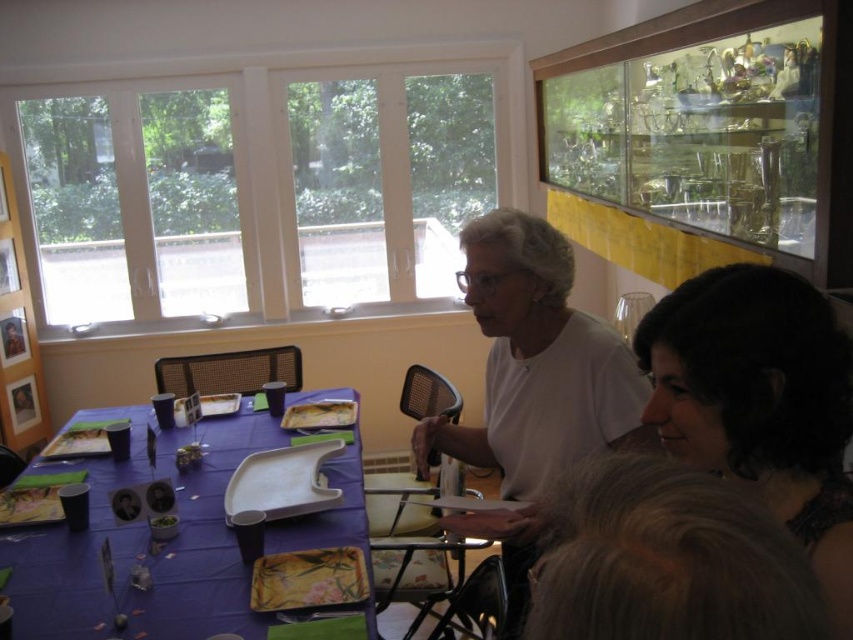
You are a guest at this event and want to greet the person with dark brown hair at upper right. From your position at the purple fabric table at lower left, in which direction should you move to approach them?

The dark brown hair at upper right is located to the right of the purple fabric table at lower left, so you should move to your right to approach them.

Consider the image. You are a guest at this event and want to know if the dark brown hair at upper right is wider than the purple fabric table at lower left. Can you determine this based on the scene?

The dark brown hair at upper right has a lesser width compared to purple fabric table at lower left, so it is not wider.

You are a guest at this event and want to know if the dark brown hair at upper right is bigger than the purple fabric table at lower left. Can you confirm?

The dark brown hair at upper right is smaller than the purple fabric table at lower left, so it is not bigger.